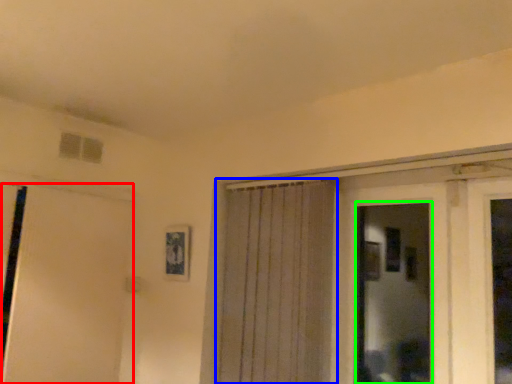
Question: Which object is the farthest from door (highlighted by a red box)? Choose among these: curtain (highlighted by a blue box) or bay window (highlighted by a green box).

Choices:
 (A) curtain
 (B) bay window

Answer: (B)